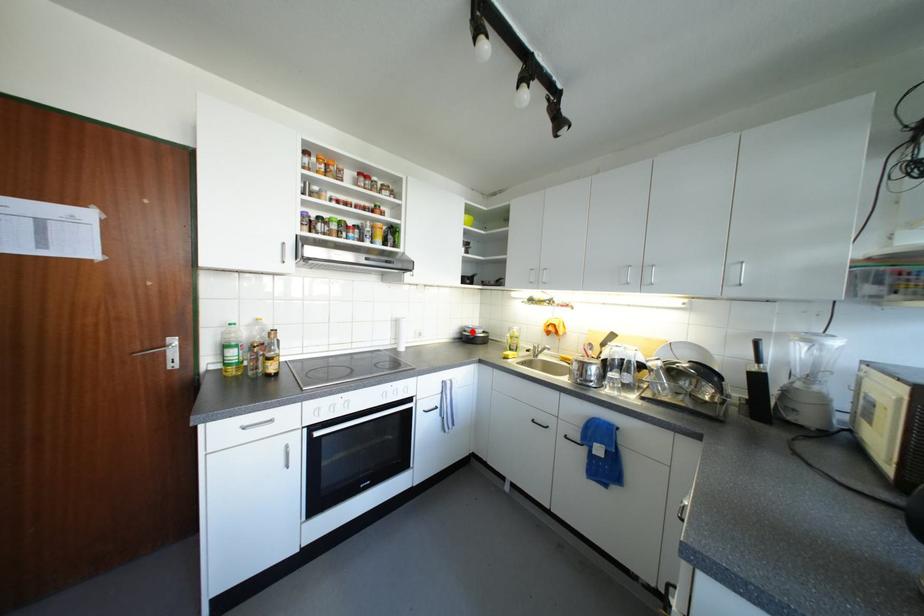
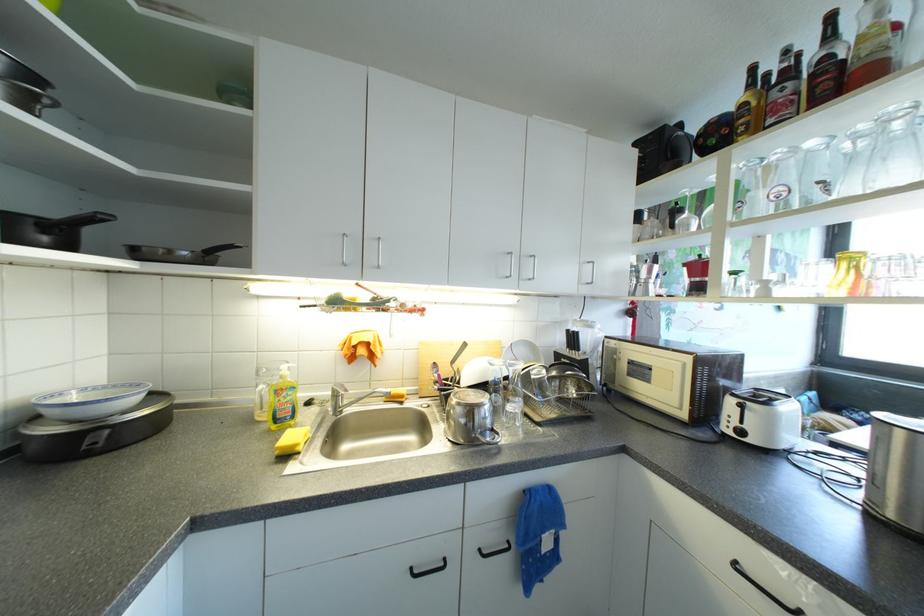
Where in the second image is the point corresponding to the highlighted location from the first image?

(55, 413)